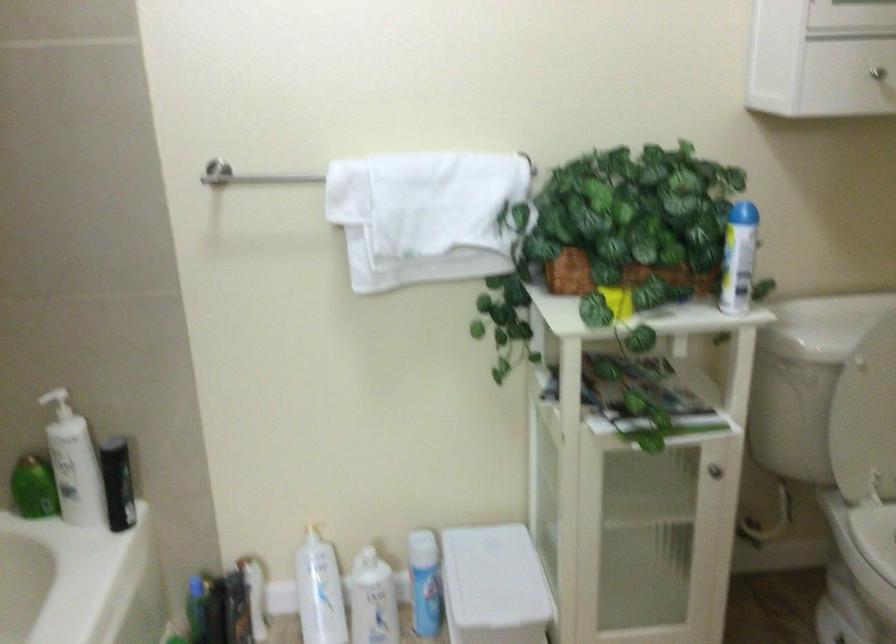
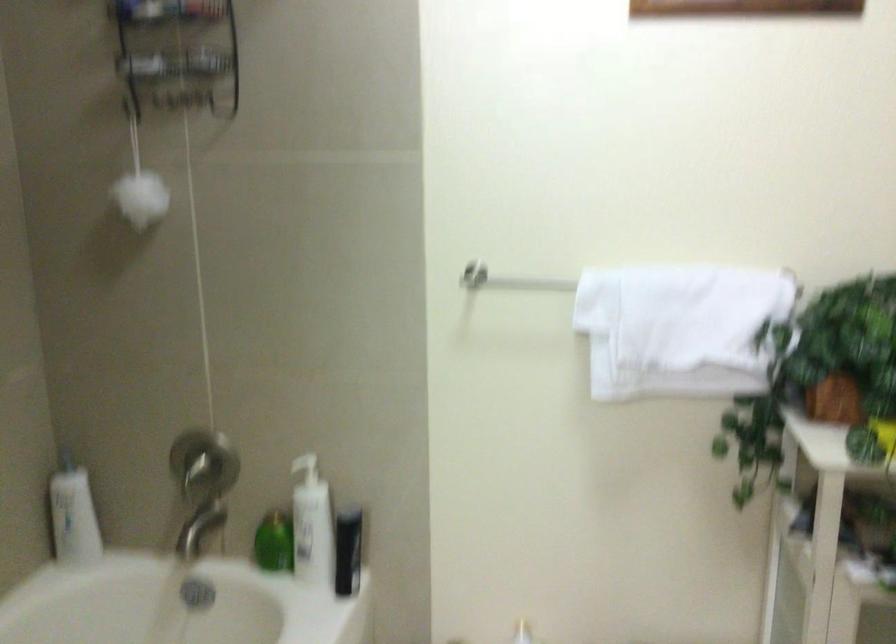
Question: The images are taken continuously from a first-person perspective. In which direction are you moving?

Choices:
 (A) Left
 (B) Right
 (C) Forward
 (D) Backward

Answer: (A)